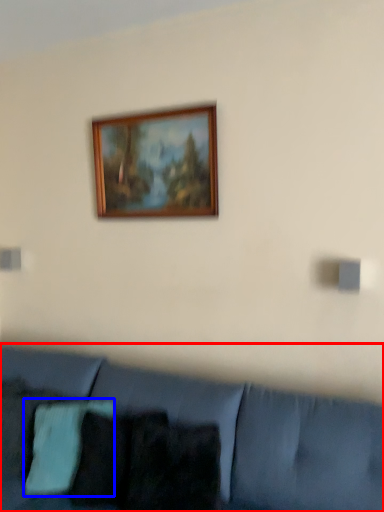
Question: Which point is further to the camera, studio couch (highlighted by a red box) or pillow (highlighted by a blue box)?

Choices:
 (A) studio couch
 (B) pillow

Answer: (B)